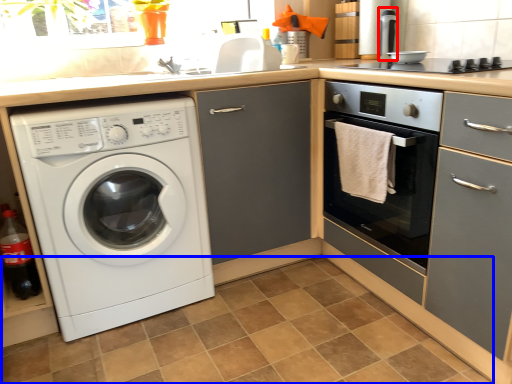
Question: Which object is further to the camera taking this photo, appliance (highlighted by a red box) or tile (highlighted by a blue box)?

Choices:
 (A) appliance
 (B) tile

Answer: (A)